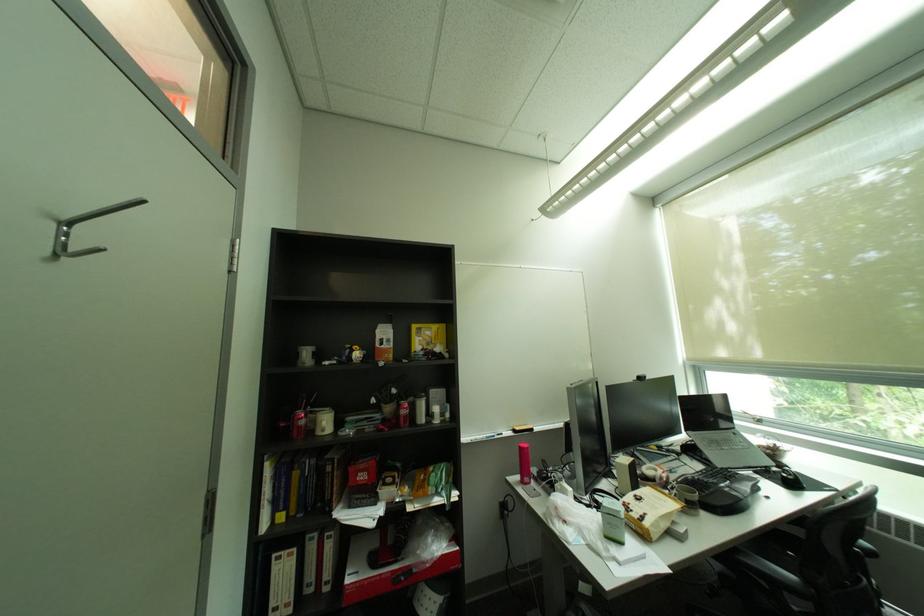
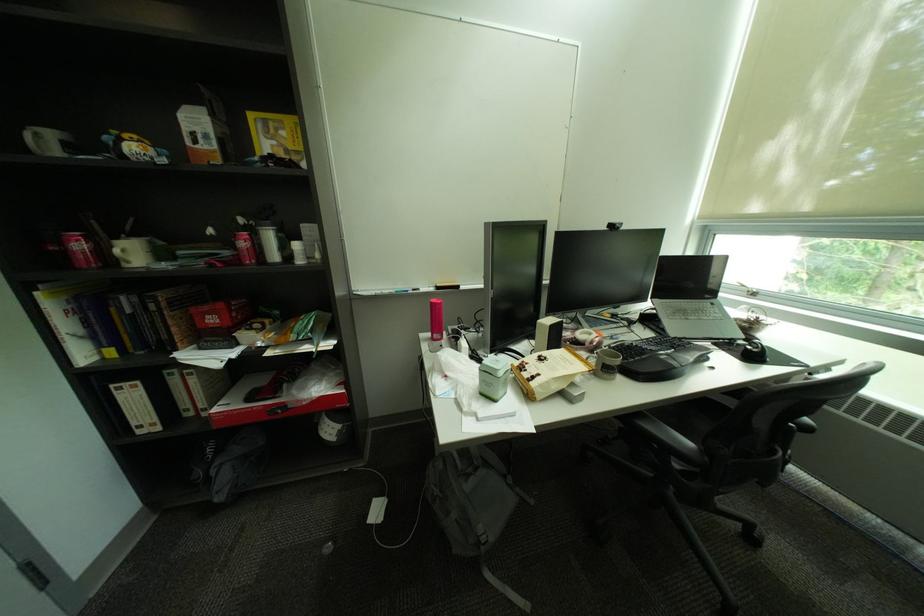
The point at (801, 479) is marked in the first image. Where is the corresponding point in the second image?

(766, 352)